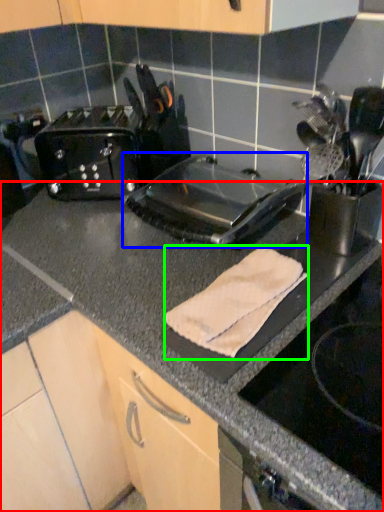
Question: Which is farther away from countertop (highlighted by a red box)? kitchen appliance (highlighted by a blue box) or bath towel (highlighted by a green box)?

Choices:
 (A) kitchen appliance
 (B) bath towel

Answer: (A)